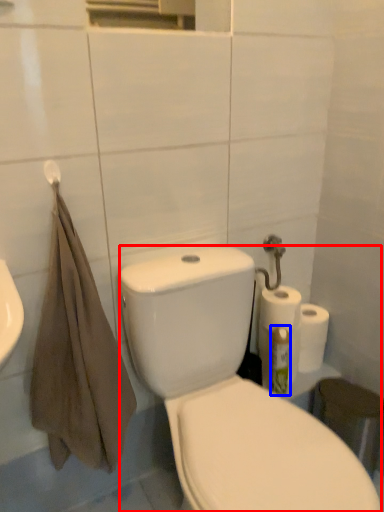
Question: Which object is closer to the camera taking this photo, porcelain (highlighted by a red box) or cleaning product (highlighted by a blue box)?

Choices:
 (A) porcelain
 (B) cleaning product

Answer: (A)